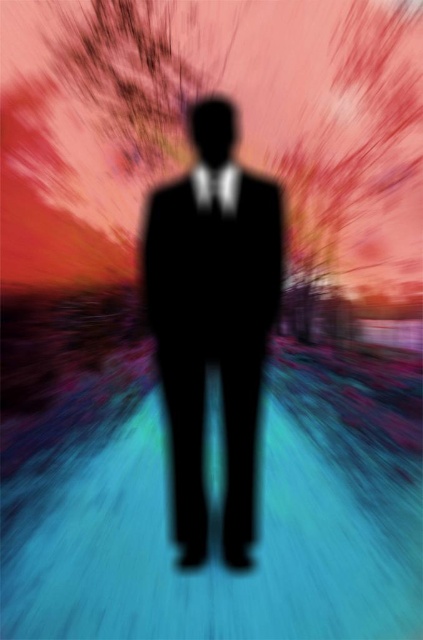
Question: Observing the image, what is the correct spatial positioning of black matte suit at center in reference to matte black tie at center?

Choices:
 (A) right
 (B) left

Answer: (B)

Question: Among these points, which one is nearest to the camera?

Choices:
 (A) (49, 42)
 (B) (214, 195)

Answer: (B)

Question: Which object is positioned closest to the matte black tie at center?

Choices:
 (A) smooth pink tree at upper left
 (B) black matte suit at center

Answer: (B)

Question: Does black matte suit at center come behind smooth pink tree at upper left?

Choices:
 (A) no
 (B) yes

Answer: (A)

Question: Based on their relative distances, which object is farther from the smooth pink tree at upper left?

Choices:
 (A) matte black tie at center
 (B) black matte suit at center

Answer: (A)

Question: Is black matte suit at center bigger than matte black tie at center?

Choices:
 (A) yes
 (B) no

Answer: (A)